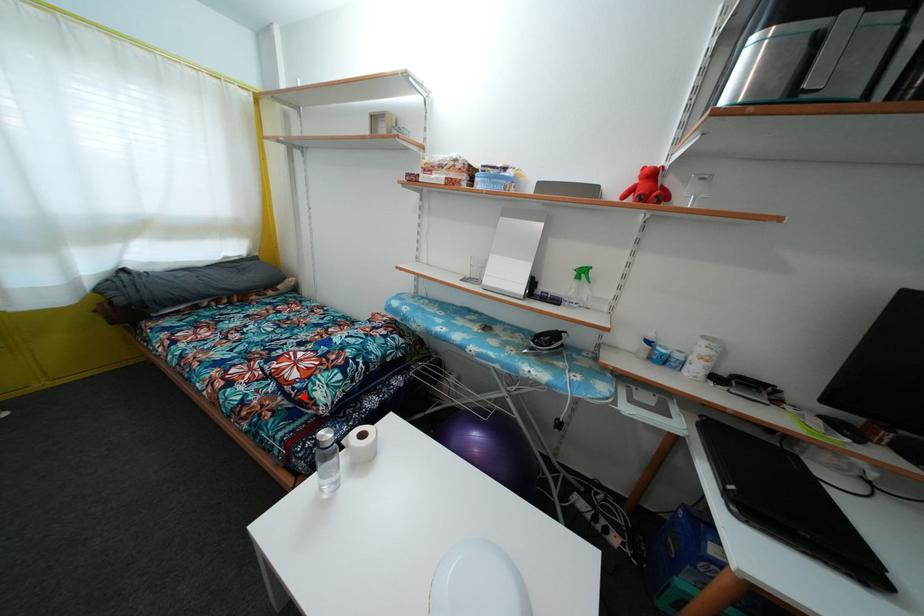
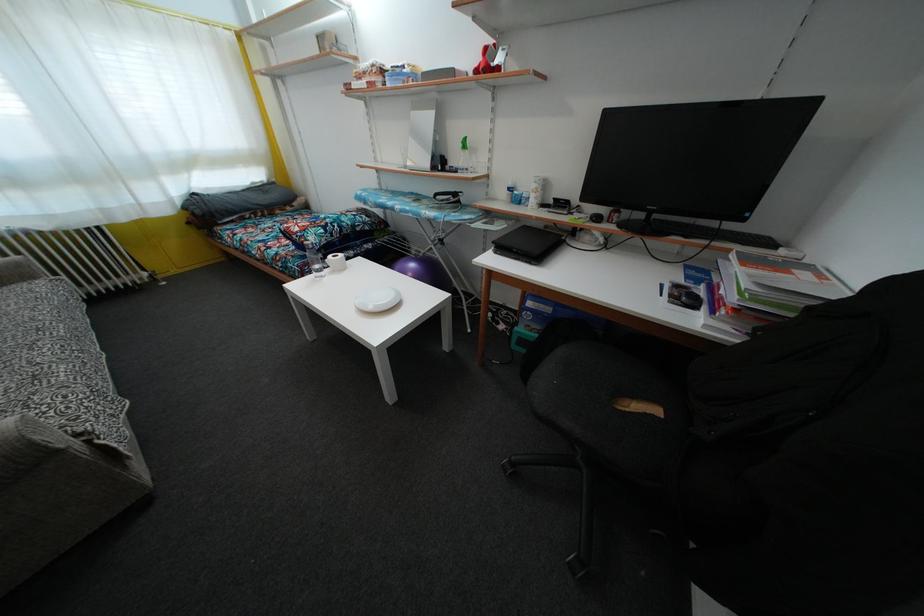
The point at the highlighted location is marked in the first image. Where is the corresponding point in the second image?

(305, 244)